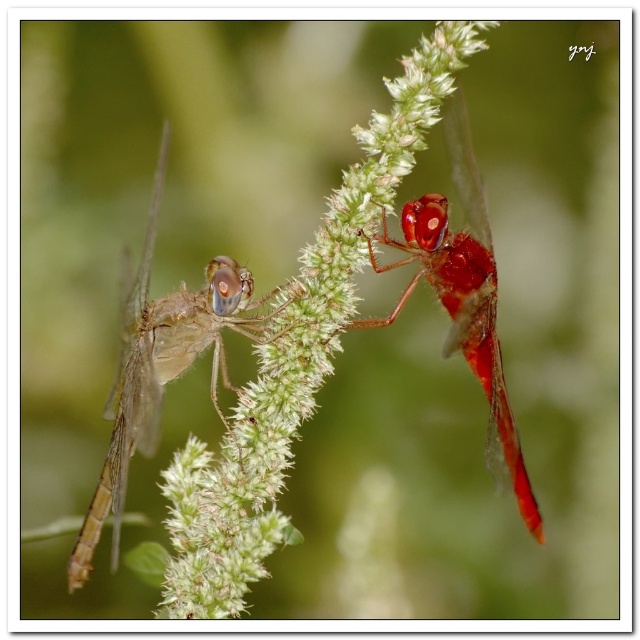
You are trying to locate the translucent brown dragonfly at left in the image. Can you tell me where exactly the point at coordinate point [164,365] is located on it?

The point at coordinate point [164,365] is located on the translucent brown dragonfly at left.

You are an entomologist observing the two dragonflies on the plant. Which dragonfly has a larger width? The options are the translucent brown dragonfly at left and the shiny red dragonfly at upper right.

The translucent brown dragonfly at left might be wider than the shiny red dragonfly at upper right according to the description.

You are a gardener who wants to place a 30 cm ruler between the green fuzzy plant at center and the shiny red dragonfly at upper right. Will the ruler fit between them without overlapping either object?

The distance between the green fuzzy plant at center and the shiny red dragonfly at upper right is 26.22 centimeters. Since the ruler is 30 cm long, it will be longer than the space between them, causing it to overlap both objects.